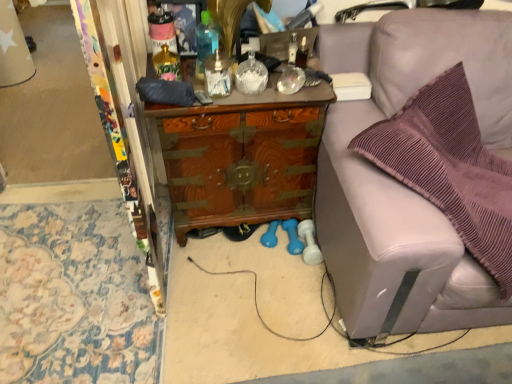
Where is `vacant area that lies to the right of translucent glass vase at center, placed as the 4th bottle when sorted from right to left`? vacant area that lies to the right of translucent glass vase at center, placed as the 4th bottle when sorted from right to left is located at coordinates (197, 90).